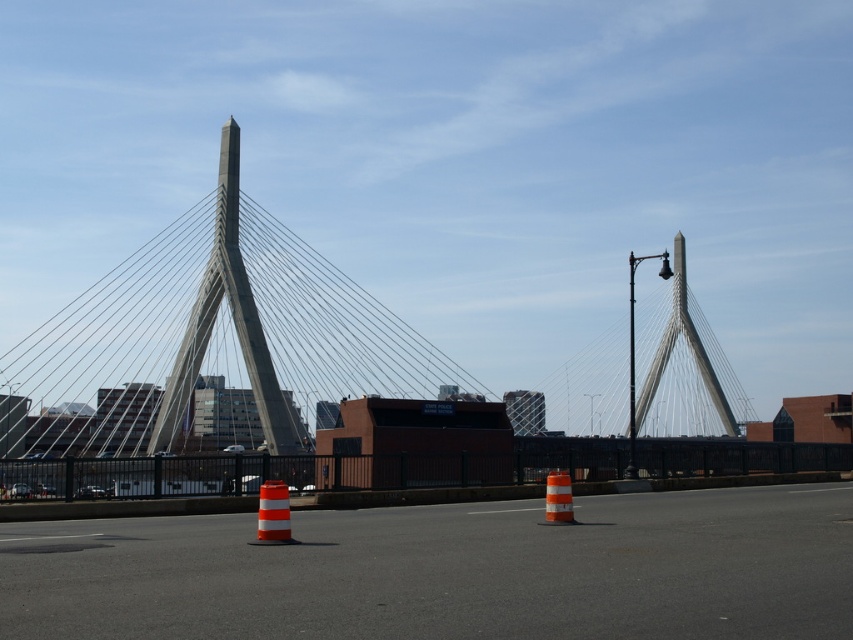
Question: Where is orange and white striped cone at center located in relation to orange reflective cone at center in the image?

Choices:
 (A) below
 (B) above

Answer: (B)

Question: Which of the following is the farthest from the observer?

Choices:
 (A) orange and white striped cone at center
 (B) orange striped traffic cones at center
 (C) gray concrete suspension bridge at center

Answer: (C)

Question: Which is nearer to the orange striped traffic cones at center?

Choices:
 (A) orange reflective cone at center
 (B) orange and white striped cone at center
 (C) gray concrete suspension bridge at center

Answer: (A)

Question: Can you confirm if orange and white striped cone at center is thinner than orange reflective cone at center?

Choices:
 (A) no
 (B) yes

Answer: (B)

Question: Which is nearer to the orange striped traffic cones at center?

Choices:
 (A) orange reflective cone at center
 (B) orange and white striped cone at center

Answer: (A)

Question: Is the position of orange striped traffic cones at center less distant than that of orange reflective cone at center?

Choices:
 (A) no
 (B) yes

Answer: (B)